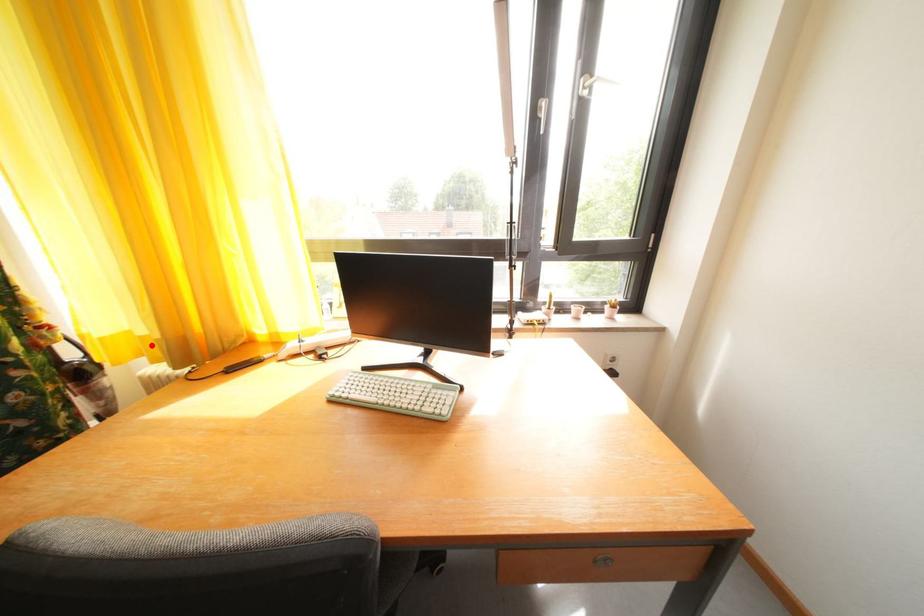
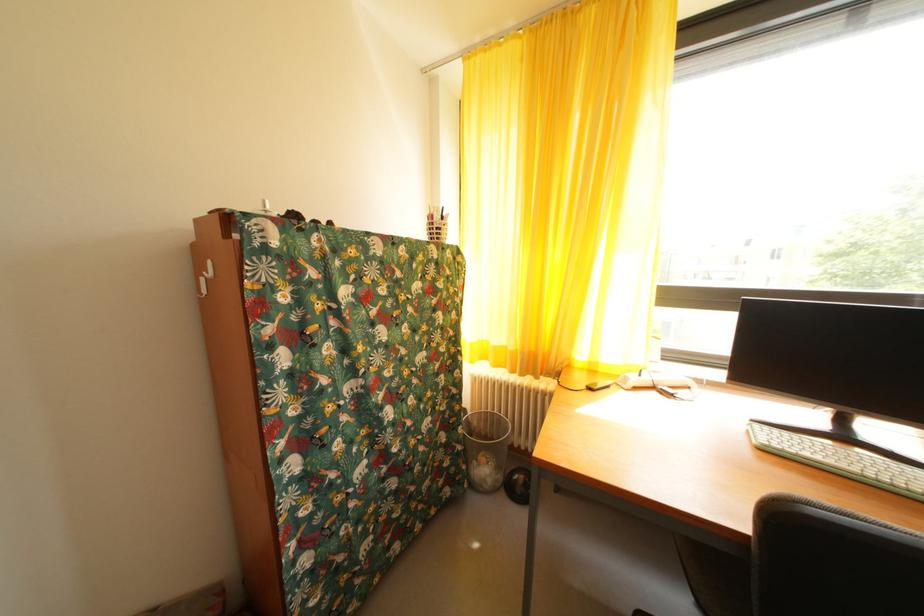
Locate, in the second image, the point that corresponds to the highlighted location in the first image.

(505, 354)